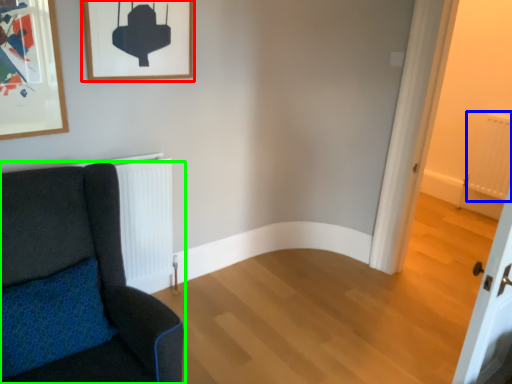
Question: Based on their relative distances, which object is farther from picture frame (highlighted by a red box)? Choose from radiator (highlighted by a blue box) and chair (highlighted by a green box).

Choices:
 (A) radiator
 (B) chair

Answer: (A)